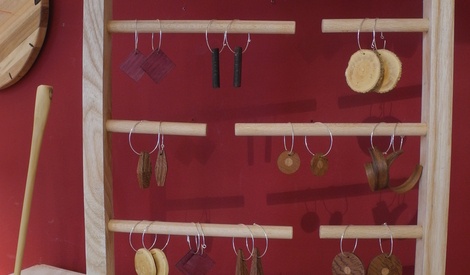
This screenshot has width=470, height=275. I want to click on wall, so click(67, 178).